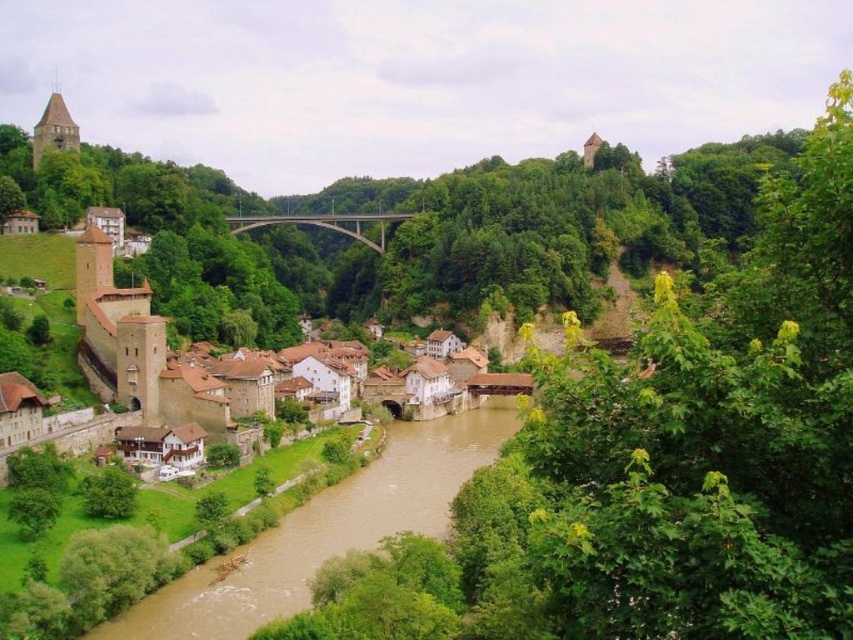
You are standing at the point marked by coordinates point (325, 531) in the image, which is located in the brown muddy water at lower center. Looking around, what direction would you face to see the historic stone structure with towers and turrets on the left side of the image?

You would face towards the left side of the image to see the historic stone structure with towers and turrets, as the point (325, 531) marks the brown muddy water at lower center, and the structure is located on the left side of the image.

You are a tourist visiting the riverside town and want to cross the river. You see the brown muddy water at lower center and the concrete bridge at center. Which object is larger in size?

The concrete bridge at center is larger than the brown muddy water at lower center.